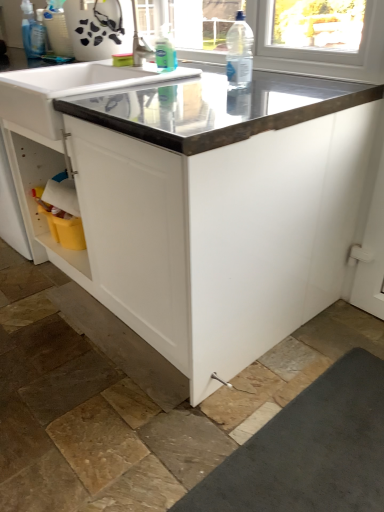
Question: From the image's perspective, is clear plastic bottle at upper center beneath metallic gray countertop at center?

Choices:
 (A) no
 (B) yes

Answer: (A)

Question: Is clear plastic bottle at upper center aimed at metallic gray countertop at center?

Choices:
 (A) yes
 (B) no

Answer: (B)

Question: Can you confirm if clear plastic bottle at upper center is thinner than metallic gray countertop at center?

Choices:
 (A) no
 (B) yes

Answer: (B)

Question: From the image's perspective, is clear plastic bottle at upper center over metallic gray countertop at center?

Choices:
 (A) yes
 (B) no

Answer: (A)

Question: Can metallic gray countertop at center be found inside clear plastic bottle at upper center?

Choices:
 (A) no
 (B) yes

Answer: (A)

Question: Considering their positions, is metallic gray countertop at center located in front of or behind translucent plastic spray bottle at upper left, arranged as the first cleaning product when viewed from the top?

Choices:
 (A) behind
 (B) front

Answer: (B)

Question: Does point (235, 203) appear closer or farther from the camera than point (28, 48)?

Choices:
 (A) farther
 (B) closer

Answer: (B)

Question: Do you think metallic gray countertop at center is within translucent plastic spray bottle at upper left, arranged as the first cleaning product when viewed from the top, or outside of it?

Choices:
 (A) outside
 (B) inside

Answer: (A)

Question: Looking at the image, does metallic gray countertop at center seem bigger or smaller compared to translucent plastic spray bottle at upper left, arranged as the second cleaning product when ordered from the bottom?

Choices:
 (A) big
 (B) small

Answer: (A)

Question: From the image's perspective, relative to white glossy sink at upper center, is metallic gray countertop at center above or below?

Choices:
 (A) above
 (B) below

Answer: (B)

Question: Is metallic gray countertop at center in front of or behind white glossy sink at upper center in the image?

Choices:
 (A) behind
 (B) front

Answer: (B)

Question: From a real-world perspective, is metallic gray countertop at center above or below white glossy sink at upper center?

Choices:
 (A) above
 (B) below

Answer: (B)

Question: Looking at the image, does metallic gray countertop at center seem bigger or smaller compared to white glossy sink at upper center?

Choices:
 (A) small
 (B) big

Answer: (B)

Question: Relative to clear plastic bottle at upper center, is white glossy sink at upper center in front or behind?

Choices:
 (A) behind
 (B) front

Answer: (A)

Question: From a real-world perspective, is white glossy sink at upper center positioned above or below clear plastic bottle at upper center?

Choices:
 (A) above
 (B) below

Answer: (B)